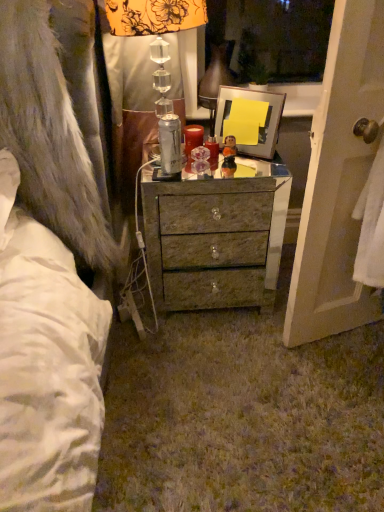
Question: Would you say matte red candle at center contains white towel at right?

Choices:
 (A) yes
 (B) no

Answer: (B)

Question: Could you tell me if matte red candle at center is turned towards white towel at right?

Choices:
 (A) no
 (B) yes

Answer: (A)

Question: Is white towel at right at the back of matte red candle at center?

Choices:
 (A) no
 (B) yes

Answer: (A)

Question: Is the depth of matte red candle at center less than that of white towel at right?

Choices:
 (A) yes
 (B) no

Answer: (B)

Question: Is matte red candle at center taller than white towel at right?

Choices:
 (A) no
 (B) yes

Answer: (A)

Question: Is fuzzy gray fur coat at left bigger or smaller than translucent glass figurine at center?

Choices:
 (A) big
 (B) small

Answer: (A)

Question: From the image's perspective, relative to translucent glass figurine at center, is fuzzy gray fur coat at left above or below?

Choices:
 (A) below
 (B) above

Answer: (A)

Question: In terms of width, does fuzzy gray fur coat at left look wider or thinner when compared to translucent glass figurine at center?

Choices:
 (A) thin
 (B) wide

Answer: (B)

Question: Is fuzzy gray fur coat at left inside the boundaries of translucent glass figurine at center, or outside?

Choices:
 (A) outside
 (B) inside

Answer: (A)

Question: In terms of height, does metallic glass lampshade at upper center look taller or shorter compared to translucent glass figurine at center?

Choices:
 (A) short
 (B) tall

Answer: (B)

Question: Visually, is metallic glass lampshade at upper center positioned to the left or to the right of translucent glass figurine at center?

Choices:
 (A) right
 (B) left

Answer: (B)

Question: Based on their sizes in the image, would you say metallic glass lampshade at upper center is bigger or smaller than translucent glass figurine at center?

Choices:
 (A) big
 (B) small

Answer: (A)

Question: Looking at their shapes, would you say metallic glass lampshade at upper center is wider or thinner than translucent glass figurine at center?

Choices:
 (A) wide
 (B) thin

Answer: (A)

Question: From the image's perspective, is silver metallic can at center located above or below metallic glass lampshade at upper center?

Choices:
 (A) below
 (B) above

Answer: (A)

Question: In terms of width, does silver metallic can at center look wider or thinner when compared to metallic glass lampshade at upper center?

Choices:
 (A) wide
 (B) thin

Answer: (B)